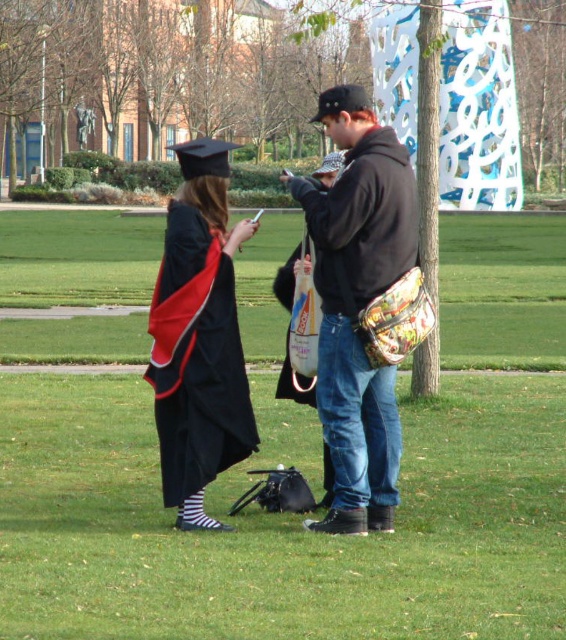
Question: Is black fleece jacket at center wider than matte black graduation gown at center?

Choices:
 (A) no
 (B) yes

Answer: (A)

Question: Is black fleece jacket at center to the right of matte black graduation gown at center from the viewer's perspective?

Choices:
 (A) yes
 (B) no

Answer: (A)

Question: Does black fleece jacket at center have a greater width compared to matte black graduation gown at center?

Choices:
 (A) yes
 (B) no

Answer: (B)

Question: Which object appears closest to the camera in this image?

Choices:
 (A) black fleece jacket at center
 (B) matte black graduation gown at center

Answer: (A)

Question: Which point is farther from the camera taking this photo?

Choices:
 (A) (201, 524)
 (B) (375, 445)

Answer: (B)